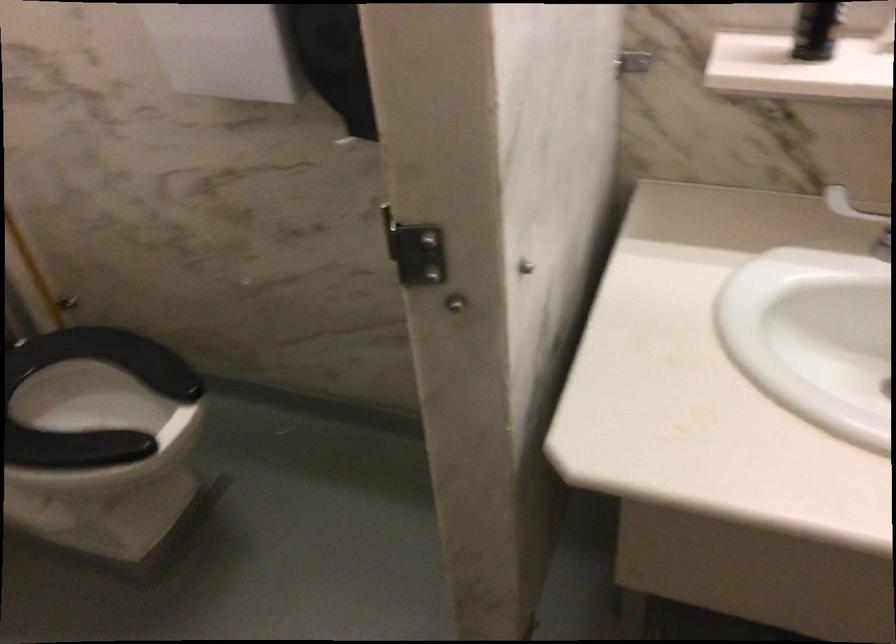
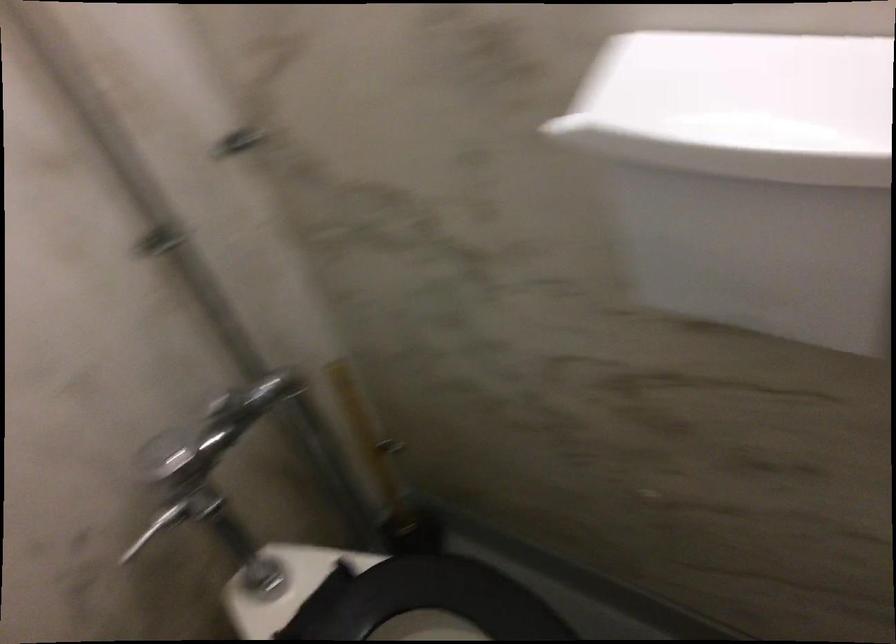
Question: The camera is either moving clockwise (left) or counter-clockwise (right) around the object. The first image is from the beginning of the video and the second image is from the end. Is the camera moving left or right when shooting the video?

Choices:
 (A) Left
 (B) Right

Answer: (B)